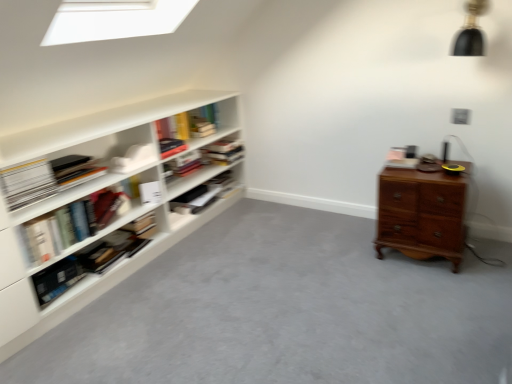
Question: Does white matte book at left, positioned as the first paperback book in left-to-right order, appear on the left side of wooden chest of drawers at right?

Choices:
 (A) no
 (B) yes

Answer: (B)

Question: Are white matte book at left, marked as the 1th paperback book in a front-to-back arrangement, and wooden chest of drawers at right making contact?

Choices:
 (A) yes
 (B) no

Answer: (B)

Question: Is white matte book at left, acting as the 2th paperback book starting from the right, positioned with its back to wooden chest of drawers at right?

Choices:
 (A) yes
 (B) no

Answer: (B)

Question: From the image's perspective, is white matte book at left, positioned as the first paperback book in left-to-right order, under wooden chest of drawers at right?

Choices:
 (A) yes
 (B) no

Answer: (B)

Question: Is white matte book at left, marked as the 1th paperback book in a front-to-back arrangement, aimed at wooden chest of drawers at right?

Choices:
 (A) yes
 (B) no

Answer: (B)

Question: Based on their positions, is hardcover book at center, marked as the second book in a top-to-bottom arrangement, located to the left or right of hardcover book at upper left, which ranks as the third book in bottom-to-top order?

Choices:
 (A) right
 (B) left

Answer: (B)

Question: Is point (162, 152) closer or farther from the camera than point (201, 162)?

Choices:
 (A) closer
 (B) farther

Answer: (A)

Question: Is hardcover book at center, marked as the second book in a top-to-bottom arrangement, in front of or behind hardcover book at upper left, which ranks as the third book in bottom-to-top order, in the image?

Choices:
 (A) front
 (B) behind

Answer: (A)

Question: From a real-world perspective, relative to hardcover book at upper left, which ranks as the third book in bottom-to-top order, is hardcover book at center, the 4th book positioned from the bottom, vertically above or below?

Choices:
 (A) below
 (B) above

Answer: (B)

Question: Considering the relative positions of white matte bookshelf at left, which is the 1th shelf from top to bottom, and hardcover book at upper left, which ranks as the third book in bottom-to-top order, in the image provided, is white matte bookshelf at left, which is the 1th shelf from top to bottom, to the left or to the right of hardcover book at upper left, which ranks as the third book in bottom-to-top order,?

Choices:
 (A) left
 (B) right

Answer: (A)

Question: From the image's perspective, is white matte bookshelf at left, arranged as the second shelf when ordered from the bottom, above or below hardcover book at upper left, which ranks as the third book in bottom-to-top order?

Choices:
 (A) below
 (B) above

Answer: (A)

Question: From a real-world perspective, is white matte bookshelf at left, arranged as the second shelf when ordered from the bottom, physically located above or below hardcover book at upper left, which is the third book from top to bottom?

Choices:
 (A) above
 (B) below

Answer: (A)

Question: Is point (109, 157) positioned closer to the camera than point (197, 165)?

Choices:
 (A) farther
 (B) closer

Answer: (B)

Question: From a real-world perspective, is matte white bookshelf at center, arranged as the 1th shelf when ordered from the bottom, physically located above or below hardcover book at center, marked as the second book in a top-to-bottom arrangement?

Choices:
 (A) above
 (B) below

Answer: (B)

Question: Considering the positions of point (174, 203) and point (174, 142), is point (174, 203) closer or farther from the camera than point (174, 142)?

Choices:
 (A) closer
 (B) farther

Answer: (B)